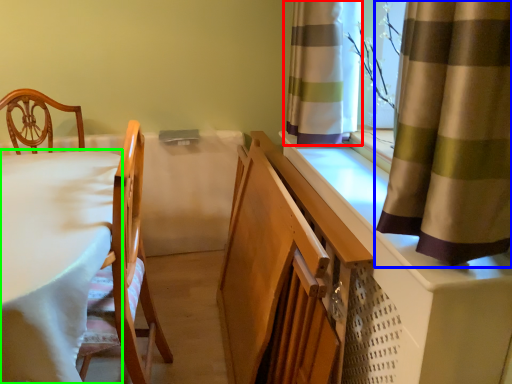
Question: Considering the real-world distances, which object is closest to curtain (highlighted by a red box)? curtain (highlighted by a blue box) or table (highlighted by a green box).

Choices:
 (A) curtain
 (B) table

Answer: (A)